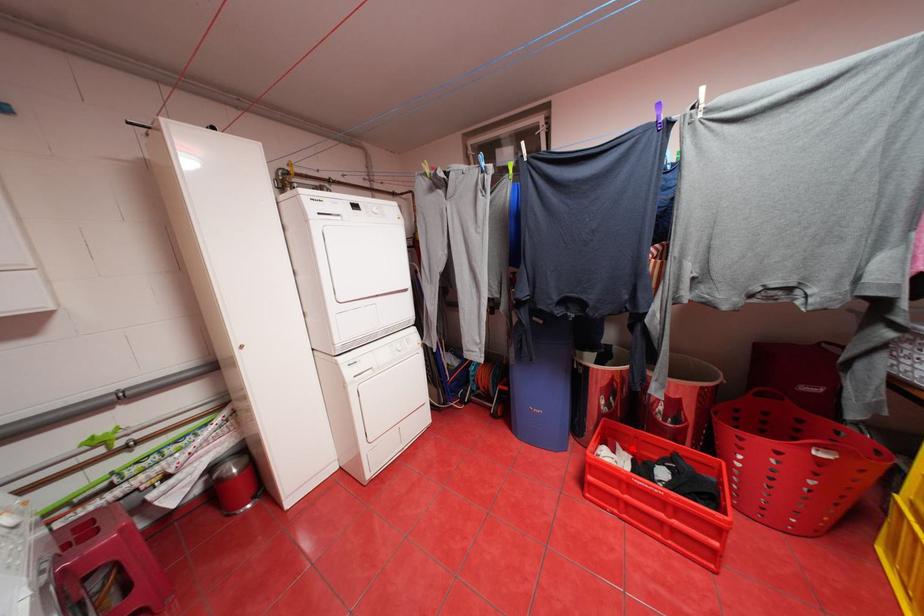
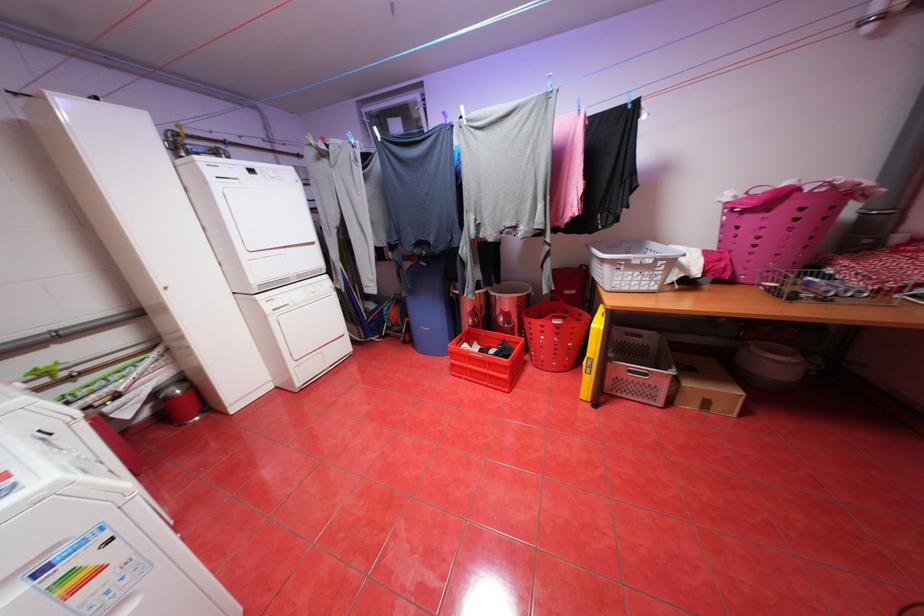
Find the pixel in the second image that matches the highlighted location in the first image.

(488, 344)